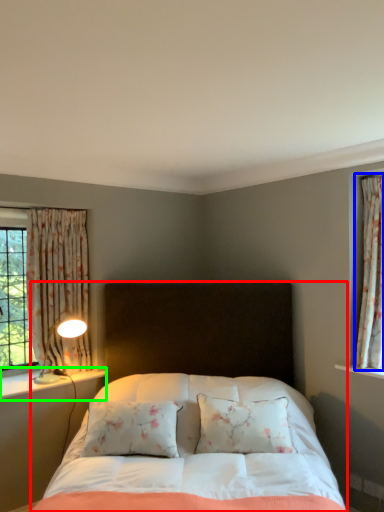
Question: Considering the real-world distances, which object is closest to bed (highlighted by a red box)? curtain (highlighted by a blue box) or window sill (highlighted by a green box).

Choices:
 (A) curtain
 (B) window sill

Answer: (B)